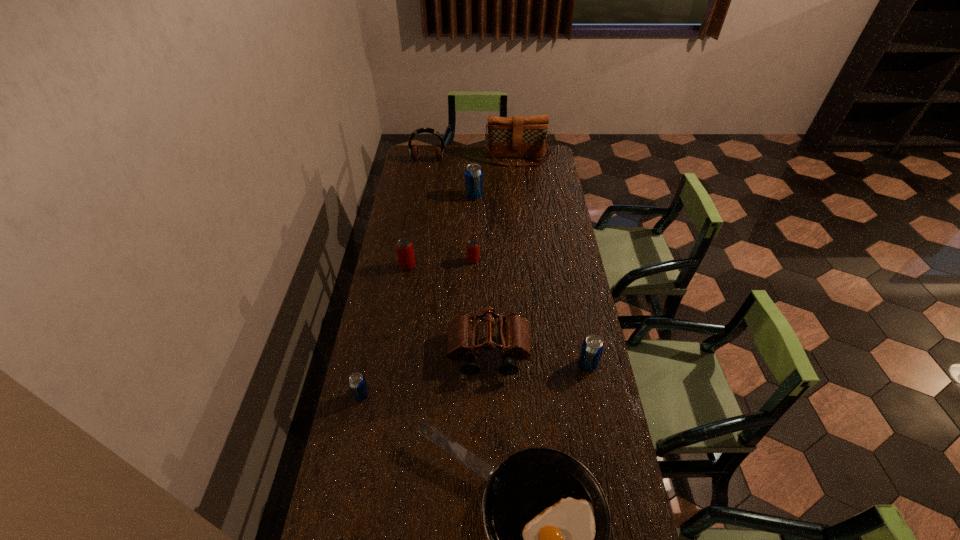
This screenshot has width=960, height=540. What are the coordinates of `vacant region at the far right corner of the desktop` in the screenshot? It's located at coord(547,161).

The image size is (960, 540). I want to click on empty location between the right pink beer can and the tallest object, so click(x=495, y=210).

Where is `vacant area that lies between the rightmost blue beer can and the right pink beer can`? vacant area that lies between the rightmost blue beer can and the right pink beer can is located at coordinates (530, 313).

The width and height of the screenshot is (960, 540). What are the coordinates of `vacant point located between the binoculars and the tallest object` in the screenshot? It's located at (503, 256).

Identify the location of unoccupied position between the binoculars and the headset. (458, 256).

The width and height of the screenshot is (960, 540). I want to click on empty location between the tallest object and the rightmost blue beer can, so click(x=552, y=262).

You are a GUI agent. You are given a task and a screenshot of the screen. Output one action in this format:
    pyautogui.click(x=<x>, y=<y>)
    Task: Click on the unoccupied area between the smaller pink beer can and the farthest beer can
    
    Given the screenshot: What is the action you would take?
    pyautogui.click(x=473, y=228)

Locate an element on the screen. The height and width of the screenshot is (540, 960). object that stands as the fourth closest to the tallest object is located at coordinates (405, 252).

Where is `the sixth closest object to the smallest blue beer can`? the sixth closest object to the smallest blue beer can is located at coordinates (592, 347).

Locate an element on the screen. The image size is (960, 540). the third closest beer can to the shoulder bag is located at coordinates (405, 252).